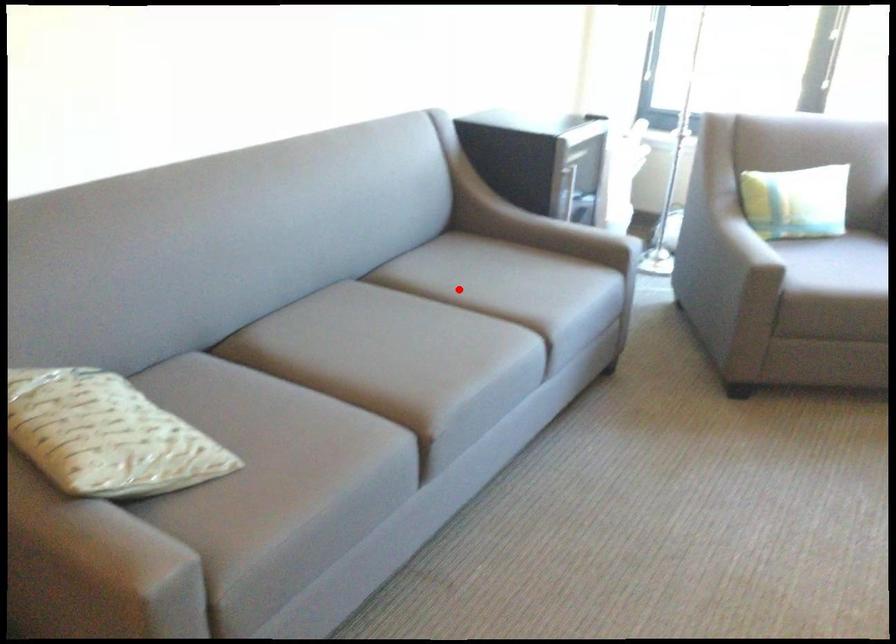
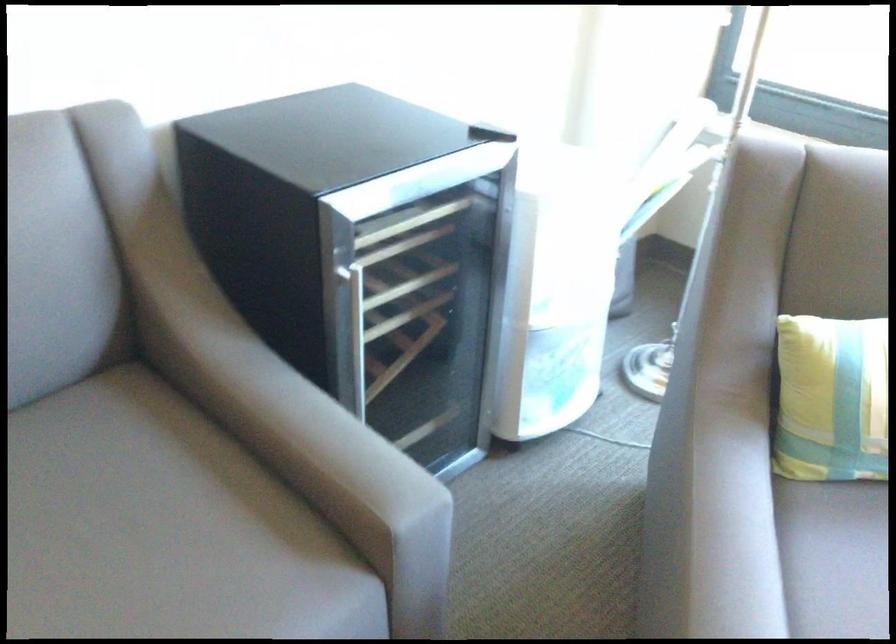
Question: A red point is marked in image1. In image2, is the corresponding 3D point closer to the camera or farther? Reply with the corresponding letter.

Choices:
 (A) The corresponding 3D point is closer.
 (B) The corresponding 3D point is farther.

Answer: (A)